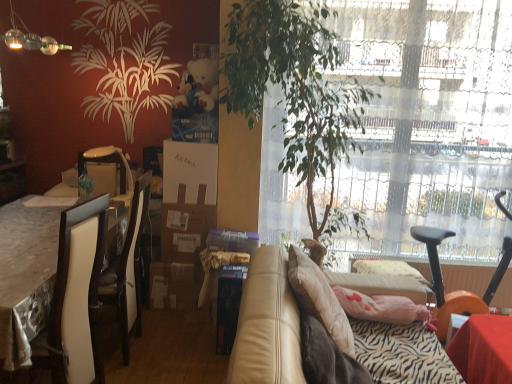
Image resolution: width=512 pixels, height=384 pixels. I want to click on leather couch at center, so click(x=267, y=324).

What is the approximate width of leather couch at center?

37.81 inches.

Locate an element on the screen. white glossy table at left is located at coordinates (25, 276).

I want to click on white cardboard box at center, the 1th box from the left, so click(x=187, y=199).

Image resolution: width=512 pixels, height=384 pixels. In order to click on matte glass lamp at upper left in this screenshot , I will do `click(30, 38)`.

This screenshot has width=512, height=384. Find the location of `leather couch at center`. leather couch at center is located at coordinates (267, 324).

Between green plastic bottle at center and blue cardboard box at center, the first box when ordered from bottom to top, which one has larger width?

blue cardboard box at center, the first box when ordered from bottom to top, is wider.

Does point (85, 187) appear closer or farther from the camera than point (234, 284)?

Point (85, 187) appears to be farther away from the viewer than point (234, 284).

Who is smaller, green plastic bottle at center or blue cardboard box at center, the first box positioned from the right?

green plastic bottle at center is smaller.

In the scene shown: Is brown cardboard box at center directly adjacent to matte white armchair at left?

No, brown cardboard box at center is not in contact with matte white armchair at left.

Locate an element on the screen. The height and width of the screenshot is (384, 512). armchair above the brown cardboard box at center (from the image's perspective) is located at coordinates (109, 162).

Is brown cardboard box at center facing towards matte white armchair at left?

No, brown cardboard box at center is not turned towards matte white armchair at left.

Would you say brown cardboard box at center is to the left or to the right of matte white armchair at left in the picture?

Based on their positions, brown cardboard box at center is located to the right of matte white armchair at left.

From the image's perspective, between green plastic bottle at center and transparent glass window at center, who is located below?

green plastic bottle at center, from the image's perspective.

Does green plastic bottle at center appear on the left side of transparent glass window at center?

Indeed, green plastic bottle at center is positioned on the left side of transparent glass window at center.

Which of these two, green plastic bottle at center or transparent glass window at center, is smaller?

With smaller size is green plastic bottle at center.

Which is in front, green plastic bottle at center or transparent glass window at center?

transparent glass window at center is in front.

Is white glossy table at left at the back of fluffy white teddy bear at upper center?

No.

In terms of height, does fluffy white teddy bear at upper center look taller or shorter compared to white glossy table at left?

In the image, fluffy white teddy bear at upper center appears to be shorter than white glossy table at left.

From the image's perspective, is fluffy white teddy bear at upper center above or below white glossy table at left?

From the image's perspective, fluffy white teddy bear at upper center appears above white glossy table at left.

From a real-world perspective, is matte white armchair at left positioned above or below green leafy plant at center?

matte white armchair at left is situated lower than green leafy plant at center in the real world.

Considering the sizes of matte white armchair at left and green leafy plant at center in the image, is matte white armchair at left taller or shorter than green leafy plant at center?

Considering their sizes, matte white armchair at left has less height than green leafy plant at center.

How different are the orientations of matte white armchair at left and green leafy plant at center in degrees?

There is a 3.25-degree angle between the facing directions of matte white armchair at left and green leafy plant at center.

Where is `toy lying behind the blue cardboard box at center, the second box in the back-to-front sequence`? toy lying behind the blue cardboard box at center, the second box in the back-to-front sequence is located at coordinates point(198,87).

Does blue cardboard box at center, which is the 2th box in left-to-right order, turn towards fluffy white teddy bear at upper center?

No, blue cardboard box at center, which is the 2th box in left-to-right order, is not facing towards fluffy white teddy bear at upper center.

Which is less distant, (x=234, y=329) or (x=184, y=77)?

Point (x=234, y=329) is closer to the camera than point (x=184, y=77).

Does blue cardboard box at center, the first box when ordered from bottom to top, have a greater width compared to fluffy white teddy bear at upper center?

In fact, blue cardboard box at center, the first box when ordered from bottom to top, might be narrower than fluffy white teddy bear at upper center.

From a real-world perspective, is white fabric pillow at center over matte glass lamp at upper left?

No, from a real-world perspective, white fabric pillow at center is not over matte glass lamp at upper left

Locate an element on the screen. lamp in front of the white fabric pillow at center is located at coordinates (30, 38).

Relative to matte glass lamp at upper left, is white fabric pillow at center in front or behind?

Visually, white fabric pillow at center is located behind matte glass lamp at upper left.

From the image's perspective, between white fabric pillow at center and matte glass lamp at upper left, who is located below?

white fabric pillow at center.

Locate an element on the screen. This screenshot has width=512, height=384. the 2nd box to the right of the green plastic bottle at center, starting your count from the anchor is located at coordinates [x=228, y=305].

Find the location of a particular element. This screenshot has height=384, width=512. armchair above the brown cardboard box at center (from the image's perspective) is located at coordinates (109, 162).

When comparing their distances from green leafy plant at center, does green plastic bottle at center or fluffy white teddy bear at upper center seem further?

green plastic bottle at center lies further to green leafy plant at center than the other object.

Based on their spatial positions, is white fabric pillow at center or blue cardboard box at center, which is the 2th box in left-to-right order, further from white cardboard box at center, the 1th box from the left?

white fabric pillow at center is positioned further to the anchor white cardboard box at center, the 1th box from the left.

When comparing their distances from leather couch at center, does brown cardboard box at center or transparent glass window at center seem further?

transparent glass window at center.

Looking at the image, which one is located further to transparent glass window at center, brown cardboard box at center or fluffy white teddy bear at upper center?

fluffy white teddy bear at upper center.

Considering their positions, is transparent glass window at center positioned further to white cardboard box at center, which ranks as the 2th box in bottom-to-top order, than white fabric pillow at center?

white fabric pillow at center lies further to white cardboard box at center, which ranks as the 2th box in bottom-to-top order, than the other object.

Estimate the real-world distances between objects in this image. Which object is further from matte white armchair at left, transparent glass window at center or blue cardboard box at center, the first box when ordered from bottom to top?

transparent glass window at center is positioned further to the anchor matte white armchair at left.

Looking at this image, looking at the image, which one is located further to matte glass lamp at upper left, green leafy plant at center or white glossy table at left?

The object further to matte glass lamp at upper left is green leafy plant at center.

Looking at the image, which one is located closer to fluffy white teddy bear at upper center, matte glass lamp at upper left or transparent glass window at center?

transparent glass window at center is closer to fluffy white teddy bear at upper center.

At what (x,y) coordinates should I click in order to perform the action: click on pillow between leather couch at center and white cardboard box at center, arranged as the second box when viewed from the front, in the front-back direction. Please return your answer as a coordinate pair (x, y). Looking at the image, I should click on (382, 285).

At what (x,y) coordinates should I click in order to perform the action: click on box situated between green plastic bottle at center and brown cardboard box at center from left to right. Please return your answer as a coordinate pair (x, y). Looking at the image, I should click on (187, 199).

Where is `cardboard box located between matte white armchair at left and green leafy plant at center in the left-right direction`? cardboard box located between matte white armchair at left and green leafy plant at center in the left-right direction is located at coordinates (185, 230).

The height and width of the screenshot is (384, 512). In order to click on houseplant between green plastic bottle at center and white fabric pillow at center from left to right in this screenshot , I will do `click(294, 88)`.